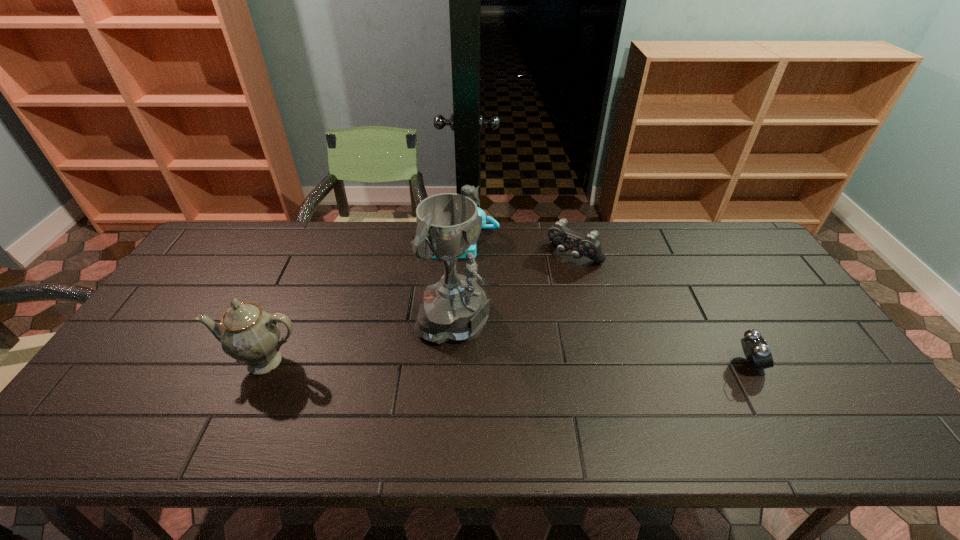
You are a GUI agent. You are given a task and a screenshot of the screen. Output one action in this format:
    pyautogui.click(x=<x>, y=<y>)
    Task: Click on the free point between the control and the alarm clock
    
    Given the screenshot: What is the action you would take?
    pyautogui.click(x=661, y=310)

At what (x,y) coordinates should I click in order to perform the action: click on vacant point located between the chinaware and the rightmost object. Please return your answer as a coordinate pair (x, y). Image resolution: width=960 pixels, height=540 pixels. Looking at the image, I should click on (507, 363).

The height and width of the screenshot is (540, 960). In order to click on free space between the second tallest object and the third tallest object in this screenshot , I will do `click(362, 301)`.

Where is `vacant space that's between the fourth object from left to right and the award`? The width and height of the screenshot is (960, 540). vacant space that's between the fourth object from left to right and the award is located at coordinates (515, 289).

This screenshot has height=540, width=960. Find the location of `object that can be found as the third closest to the control`. object that can be found as the third closest to the control is located at coordinates (758, 354).

Choose which object is the second nearest neighbor to the control. Please provide its 2D coordinates. Your answer should be formatted as a tuple, i.e. [(x, y)], where the tuple contains the x and y coordinates of a point satisfying the conditions above.

[(456, 308)]

I want to click on free spot that satisfies the following two spatial constraints: 1. on the front side of the telephone; 2. on the face of the alarm clock, so click(453, 364).

This screenshot has width=960, height=540. Identify the location of vacant space that satisfies the following two spatial constraints: 1. on the front side of the alarm clock; 2. on the face of the award. (453, 364).

This screenshot has height=540, width=960. Identify the location of vacant region that satisfies the following two spatial constraints: 1. on the back side of the third shortest object; 2. on the right side of the award. tap(460, 241).

This screenshot has width=960, height=540. Find the location of `vacant area that satisfies the following two spatial constraints: 1. on the back side of the third tallest object; 2. on the left side of the award`. vacant area that satisfies the following two spatial constraints: 1. on the back side of the third tallest object; 2. on the left side of the award is located at coordinates (460, 241).